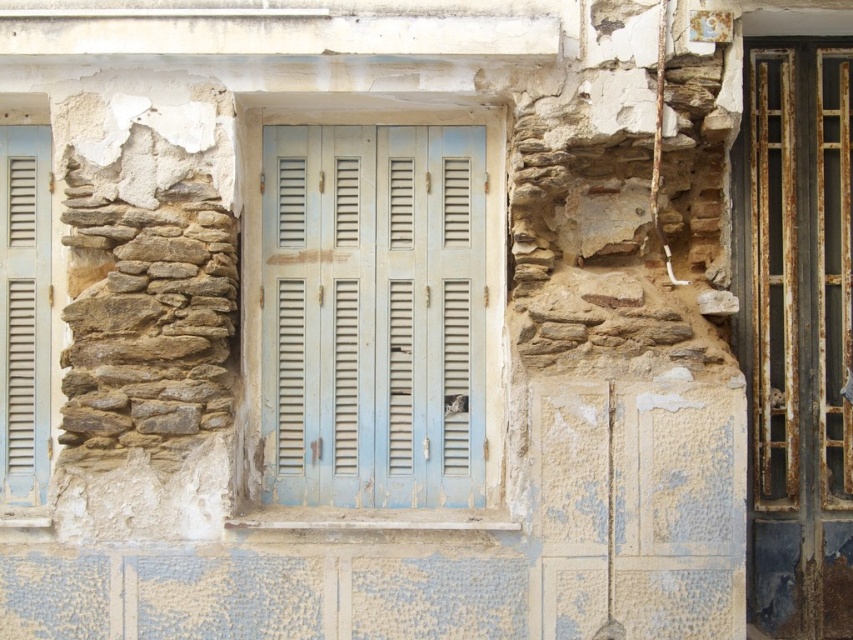
You are a painter standing between the light blue wooden shutters at center and the matte blue shutters at left. You need to reach both sets of shutters to apply a fresh coat of paint. Given that your paintbrush has a 24 inch handle, can you comfortably paint both shutters without moving your position?

The distance between the light blue wooden shutters at center and matte blue shutters at left is 30.38 inches. Since your paintbrush handle is only 24 inches long, you cannot comfortably reach both shutters from your current position without moving.

You are an architect inspecting a building facade. You notice the light blue wooden shutters at center and the matte blue shutters at left. Which of these two shutters is bigger in size?

The light blue wooden shutters at center has a larger size compared to matte blue shutters at left.